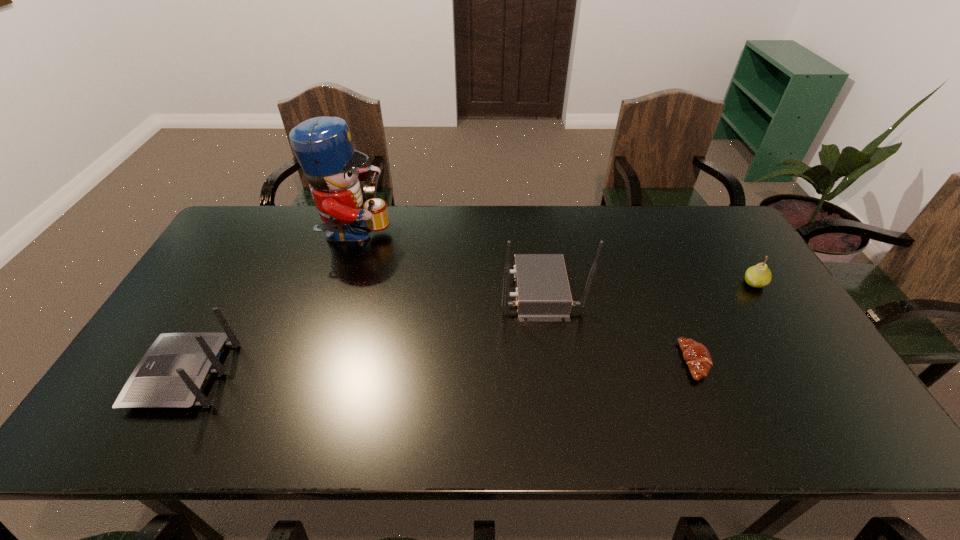
Locate an element on the screen. The height and width of the screenshot is (540, 960). object present at the near left corner is located at coordinates (173, 373).

This screenshot has height=540, width=960. Find the location of `free space at the far edge`. free space at the far edge is located at coordinates (615, 231).

This screenshot has width=960, height=540. In the image, there is a desktop. In order to click on blank space at the near edge in this screenshot , I will do coord(382,417).

In the image, there is a desktop. What are the coordinates of `free space at the left edge` in the screenshot? It's located at (245, 278).

This screenshot has height=540, width=960. Find the location of `free location at the right edge`. free location at the right edge is located at coordinates (737, 305).

In the image, there is a desktop. What are the coordinates of `vacant area at the far left corner` in the screenshot? It's located at (253, 249).

Locate an element on the screen. Image resolution: width=960 pixels, height=540 pixels. free space at the near left corner of the desktop is located at coordinates (168, 410).

In the image, there is a desktop. Identify the location of free region at the far right corner. The height and width of the screenshot is (540, 960). (725, 236).

The image size is (960, 540). I want to click on free space between the rightmost object and the shortest object, so click(x=725, y=322).

Identify the location of free space between the third tallest object and the tallest object. (270, 306).